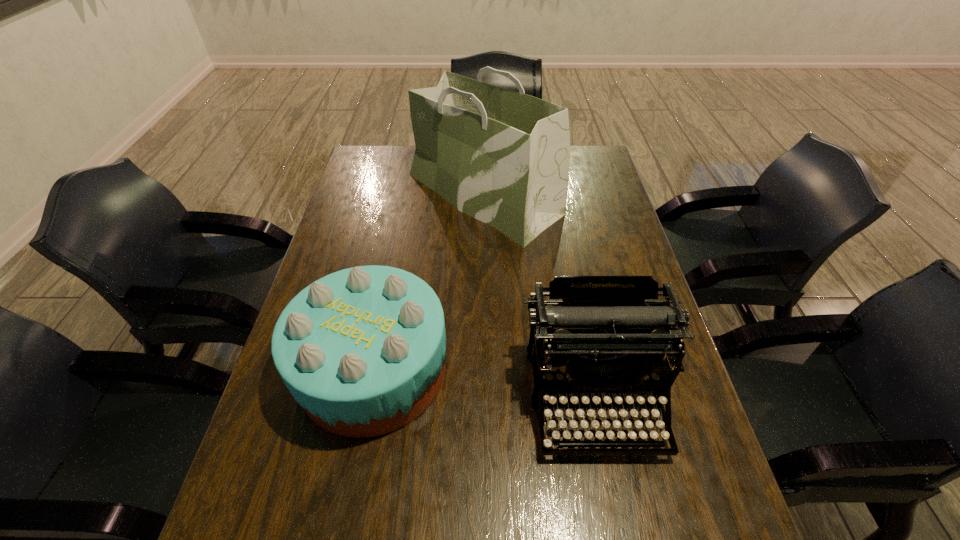
Locate an element on the screen. Image resolution: width=960 pixels, height=540 pixels. the tallest object is located at coordinates (502, 157).

Where is `grocery bag`? The height and width of the screenshot is (540, 960). grocery bag is located at coordinates (502, 157).

Identify the location of typewriter. This screenshot has height=540, width=960. (603, 336).

This screenshot has width=960, height=540. Find the location of `cake`. cake is located at coordinates (362, 350).

Identify the location of vacant position located 0.230m on the front of the tallest object. (484, 307).

Image resolution: width=960 pixels, height=540 pixels. In order to click on vacant space located 0.060m on the typing side of the typewriter in this screenshot , I will do `click(613, 493)`.

Find the location of a particular element. This screenshot has width=960, height=540. free space located on the back of the cake is located at coordinates (396, 253).

At what (x,y) coordinates should I click in order to perform the action: click on object that is at the far edge. Please return your answer as a coordinate pair (x, y). The height and width of the screenshot is (540, 960). Looking at the image, I should click on point(502,157).

Identify the location of object located in the left edge section of the desktop. [x=362, y=350].

Locate an element on the screen. The width and height of the screenshot is (960, 540). object located at the right edge is located at coordinates (603, 336).